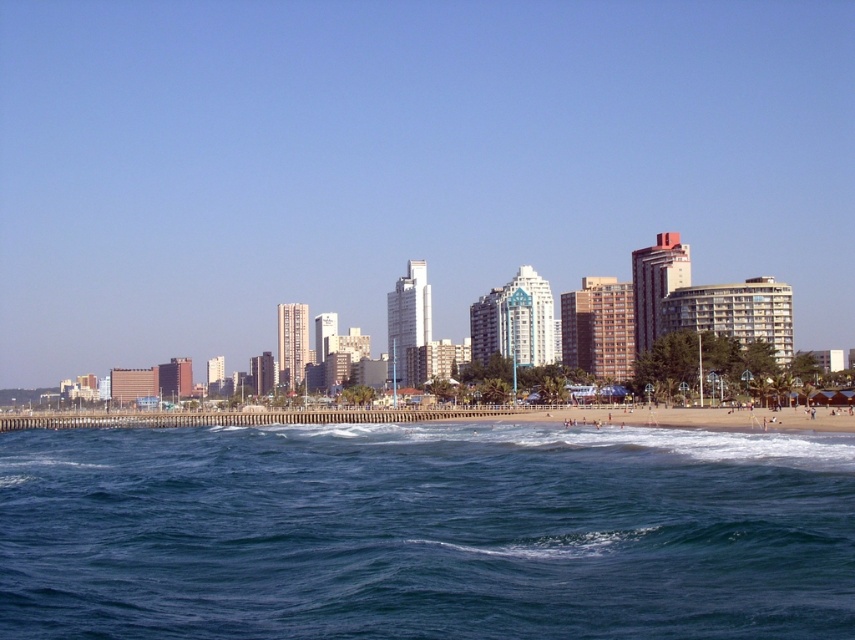
You are a lifeguard standing on the beach and want to quickly reach the blue water at lower center. Considering the smooth sand beach at lower center is between you and the water, how does the distance of the beach compare to the water in terms of their heights?

The blue water at lower center is shorter than the smooth sand beach at lower center, meaning the beach is higher than the water. Therefore, you would need to descend from the higher beach to reach the lower water.

You are standing on the smooth sand beach at lower center and want to reach the blue water at lower center. Which direction should you move to get there?

Since the blue water at lower center is closer to the viewer than the smooth sand beach at lower center, you should move forward towards the blue water at lower center to reach it.

You are standing at the point marked as point (x=425, y=532) in the image. Based on the scene description, what type of terrain are you currently on?

The point (x=425, y=532) is on blue water at lower center, so you are standing on water.